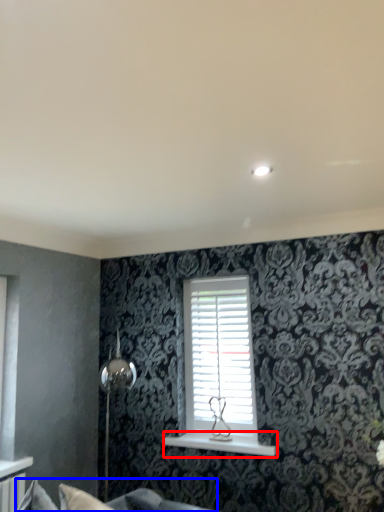
Question: Which of the following is the farthest to the observer, window sill (highlighted by a red box) or couch (highlighted by a blue box)?

Choices:
 (A) window sill
 (B) couch

Answer: (A)